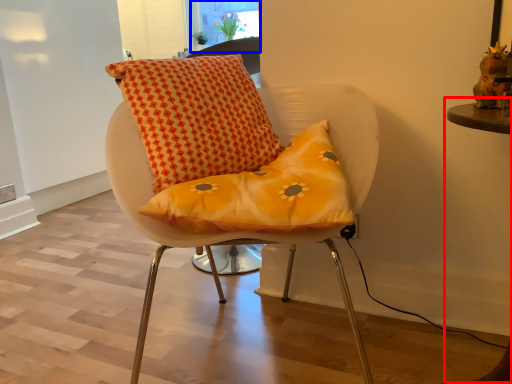
Question: Which object is closer to the camera taking this photo, table (highlighted by a red box) or window screen (highlighted by a blue box)?

Choices:
 (A) table
 (B) window screen

Answer: (A)